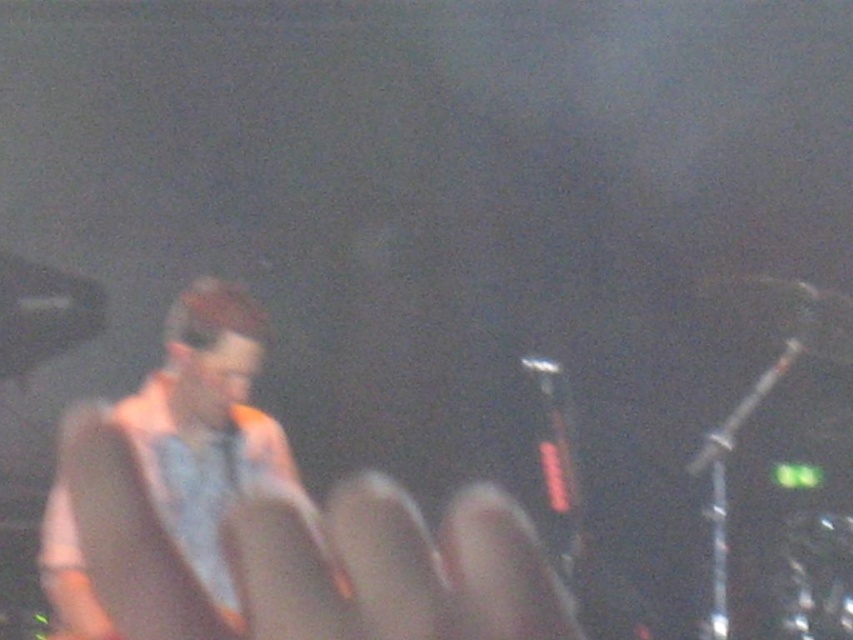
You are a stagehand who needs to adjust the lighting for the performer. You have a spotlight that has a 100 cm range. The spotlight is currently pointed at the light brown leather jacket at left. Can you adjust the spotlight to also illuminate the matte gray hand at center without moving the spotlight?

The matte gray hand at center is 98.32 centimeters from the light brown leather jacket at left. Since the spotlight has a 100 cm range, it can reach the matte gray hand at center from the light brown leather jacket at left without needing to move the spotlight.

You are a photographer at the concert venue trying to capture a clear shot of the performer. You notice the matte gray hand at center in your viewfinder. Based on its position, can you estimate whether it is closer to the top or bottom of the image?

The matte gray hand at center is located at point coordinates approximately 0.891 on the x axis and 0.467 on the y axis. Since the y coordinate is closer to 1, it is positioned closer to the bottom of the image.